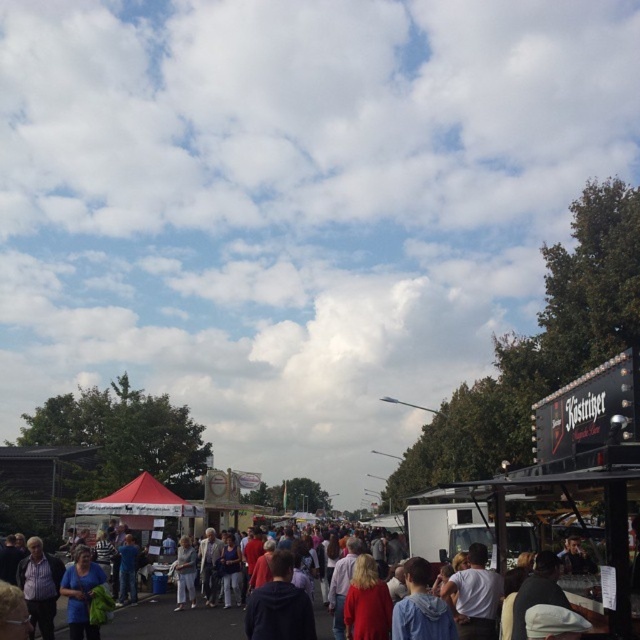
Question: Which point appears farthest from the camera in this image?

Choices:
 (A) (140, 612)
 (B) (77, 561)

Answer: (A)

Question: Which point is closer to the camera taking this photo?

Choices:
 (A) (86, 596)
 (B) (204, 636)

Answer: (A)

Question: Observing the image, what is the correct spatial positioning of dark blue hoodie at center in reference to blue cotton shirt at lower left?

Choices:
 (A) right
 (B) left

Answer: (A)

Question: Does matte blue hoodie at center come behind dark blue hoodie at center?

Choices:
 (A) no
 (B) yes

Answer: (B)

Question: Which is nearer to the dark blue hoodie at center?

Choices:
 (A) blue cotton shirt at lower left
 (B) matte blue hoodie at center

Answer: (B)

Question: Does matte blue hoodie at center appear on the left side of blue cotton shirt at lower left?

Choices:
 (A) no
 (B) yes

Answer: (A)